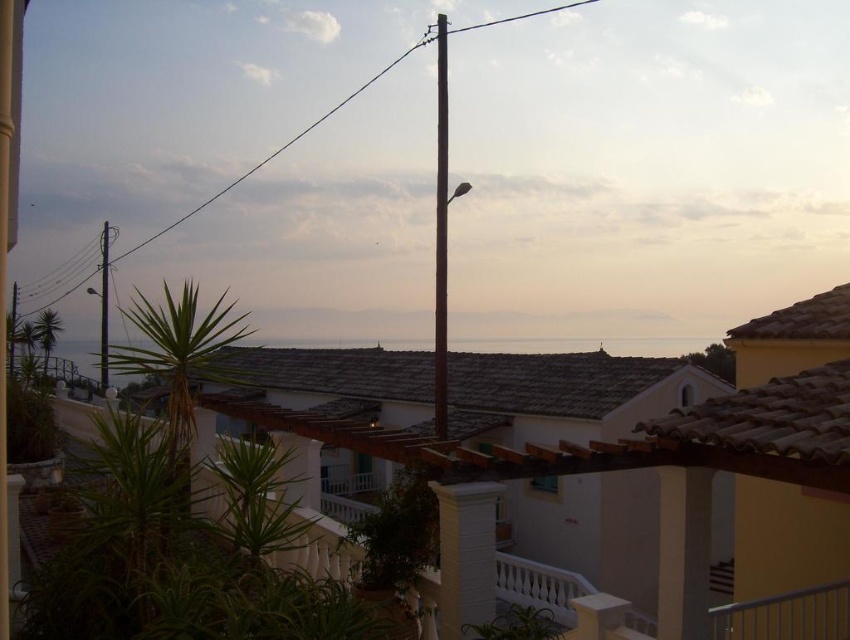
Who is higher up, wooden pergola at center or brown wooden pole at center?

brown wooden pole at center is higher up.

Does wooden pergola at center have a lesser height compared to brown wooden pole at center?

Correct, wooden pergola at center is not as tall as brown wooden pole at center.

Measure the distance between point (605, 445) and camera.

The distance of point (605, 445) from camera is 7.64 meters.

Find the location of a particular element. Image resolution: width=850 pixels, height=640 pixels. wooden pergola at center is located at coordinates (638, 440).

Image resolution: width=850 pixels, height=640 pixels. In order to click on wooden pergola at center in this screenshot , I will do `click(638, 440)`.

In the scene shown: Who is taller, wooden pergola at center or gray stone water at center?

With more height is gray stone water at center.

Does point (678, 428) come farther from viewer compared to point (17, 342)?

That is False.

At what (x,y) coordinates should I click in order to perform the action: click on wooden pergola at center. Please return your answer as a coordinate pair (x, y). Image resolution: width=850 pixels, height=640 pixels. Looking at the image, I should click on (638, 440).

How distant is brown wooden pole at center from metallic pole at upper center?

brown wooden pole at center and metallic pole at upper center are 15.13 meters apart.

Is brown wooden pole at center bigger than metallic pole at upper center?

Yes, brown wooden pole at center is bigger than metallic pole at upper center.

Between point (41, 305) and point (102, 337), which one is positioned in front?

Point (102, 337)

Identify the location of brown wooden pole at center. The height and width of the screenshot is (640, 850). (273, 150).